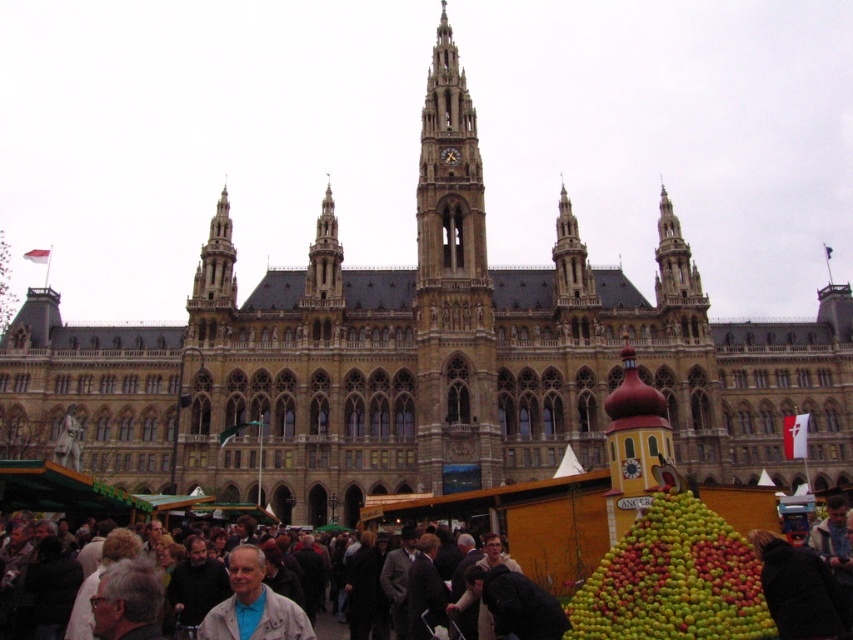
You are a delivery person carrying a box that is 2 meters wide. You need to pass between the dark brown coat at lower right and the golden stone tower at center. Can you fit through the space between them?

The dark brown coat at lower right might be wider than golden stone tower at center, so the space between them may not be wide enough for a 2 meter wide box. It is uncertain and you should check the actual width before proceeding.

You are standing at the entrance of the historic Gothic building and want to buy some apples. Where are the green matte apples at lower right located in relation to the building?

The green matte apples at lower right are positioned at coordinates point [672,579], which places them near the lower right corner of the scene, close to the entrance of the historic building.